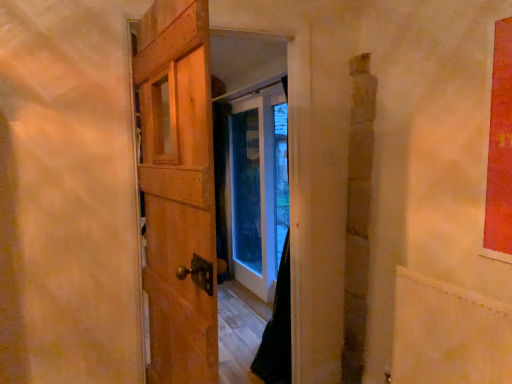
Find the location of a particular element. The height and width of the screenshot is (384, 512). vacant region above smooth beige plywood at lower right (from a real-world perspective) is located at coordinates (461, 287).